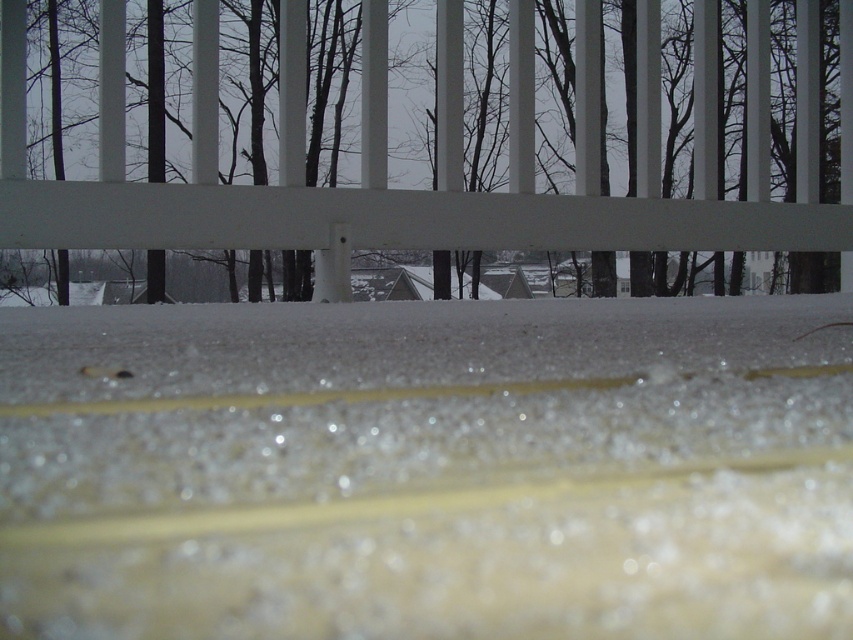
You are standing in the winter scene and notice the translucent ice crystals at center and the brown wood tree at upper center. Which object is closer to you?

The translucent ice crystals at center are closer to you because they are positioned in front of the brown wood tree at upper center.

You are standing in a winter scene and see the translucent ice crystals at center and the brown wood tree at upper center. Which object is closer to the viewer?

The translucent ice crystals at center are closer to the viewer because they are positioned below the brown wood tree at upper center, indicating they are in the foreground.